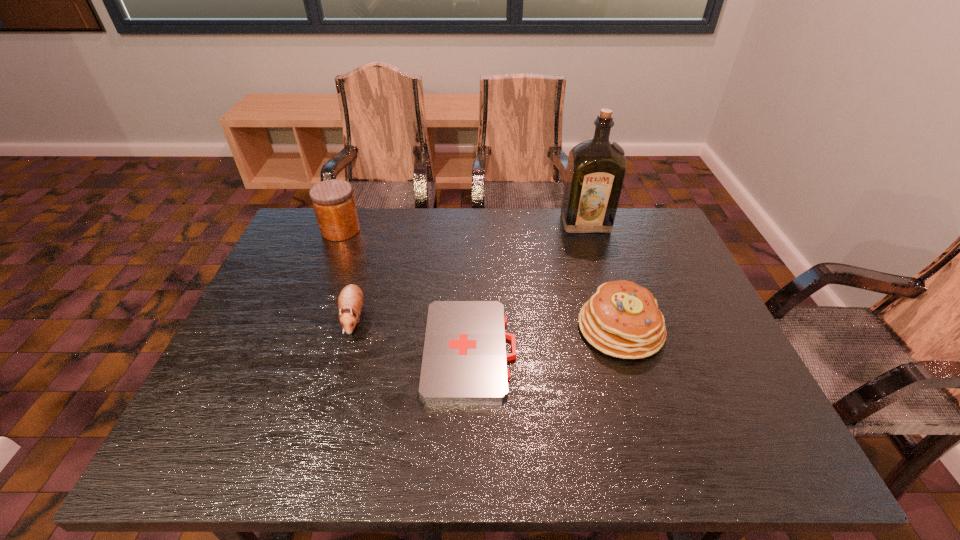
You are a GUI agent. You are given a task and a screenshot of the screen. Output one action in this format:
    pyautogui.click(x=<x>, y=<y>)
    Task: Click on the vacant space at the left edge
    
    Given the screenshot: What is the action you would take?
    point(247,367)

Find the location of `blank space at the right edge of the desktop`. blank space at the right edge of the desktop is located at coordinates (735, 386).

This screenshot has height=540, width=960. Find the location of `vacant region at the far left corner of the desktop`. vacant region at the far left corner of the desktop is located at coordinates (310, 209).

Locate an element on the screen. This screenshot has width=960, height=540. free point at the near left corner is located at coordinates (237, 437).

Where is `vacant space at the far right corner of the desktop`? vacant space at the far right corner of the desktop is located at coordinates (624, 218).

This screenshot has height=540, width=960. What are the coordinates of `vacant area that lies between the first-aid kit and the jar` in the screenshot? It's located at (405, 289).

You are a GUI agent. You are given a task and a screenshot of the screen. Output one action in this format:
    pyautogui.click(x=<x>, y=<y>)
    Task: Click on the free space between the jar and the first-aid kit
    
    Given the screenshot: What is the action you would take?
    [x=405, y=289]

Locate an element on the screen. The image size is (960, 540). vacant area that lies between the pancake and the tallest object is located at coordinates (603, 276).

At what (x,y) coordinates should I click in order to perform the action: click on empty space between the jar and the hamster. Please return your answer as a coordinate pair (x, y). Looking at the image, I should click on (348, 274).

Where is `unoccupied position between the fourth tallest object and the leftmost object`? This screenshot has height=540, width=960. unoccupied position between the fourth tallest object and the leftmost object is located at coordinates (348, 274).